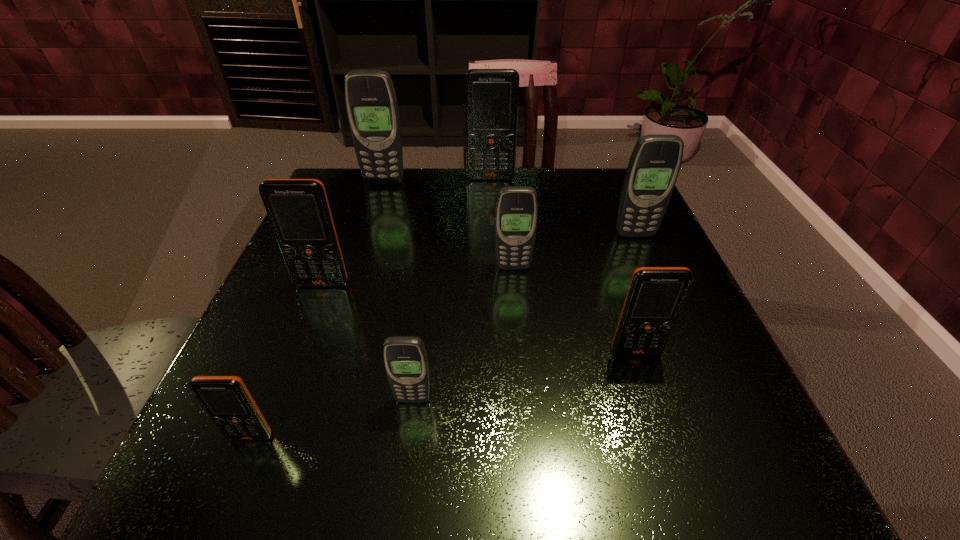
Find the location of a particular element. the second smallest orange cellular telephone is located at coordinates (655, 296).

In order to click on the sixth farthest object in this screenshot , I will do `click(655, 296)`.

Identify the location of the nearest object. (226, 399).

I want to click on the nearest cellular telephone, so click(226, 399).

You are a GUI agent. You are given a task and a screenshot of the screen. Output one action in this format:
    pyautogui.click(x=<x>, y=<y>)
    Task: Click on the nearest gray cellular telephone
    Image resolution: width=960 pixels, height=540 pixels.
    Given the screenshot: What is the action you would take?
    pyautogui.click(x=405, y=358)

You are a GUI agent. You are given a task and a screenshot of the screen. Output one action in this format:
    pyautogui.click(x=<x>, y=<y>)
    Task: Click on the seventh farthest cellular telephone
    This screenshot has width=960, height=540.
    Given the screenshot: What is the action you would take?
    pyautogui.click(x=405, y=358)

I want to click on blank space located on the screen of the third orange cellular telephone from left to right, so (493, 272).

In order to click on vacant area located 0.290m on the screen of the leftmost gray cellular telephone in this screenshot , I will do `click(360, 258)`.

Locate an element on the screen. This screenshot has width=960, height=540. free space located 0.050m on the screen of the second farthest orange cellular telephone is located at coordinates (313, 308).

Where is `vacant space situated on the screen of the rightmost gray cellular telephone`? vacant space situated on the screen of the rightmost gray cellular telephone is located at coordinates click(676, 329).